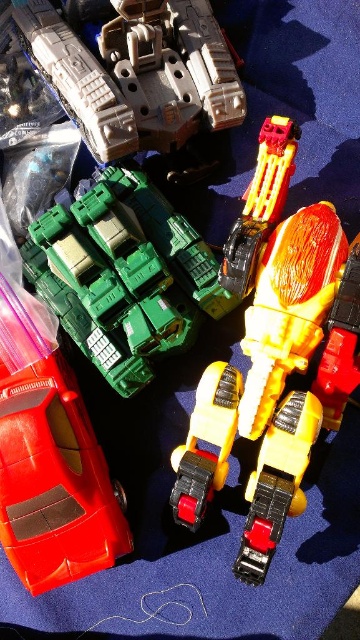
You are a child who wants to place a new toy between the shiny red car at lower left and the shiny plastic robot at center. The new toy is 30 centimeters long. Can you fit it between them?

The shiny red car at lower left is 57.64 centimeters away from the shiny plastic robot at center. Since the distance between them is greater than the length of the new toy, the toy can be placed between them.

Looking at this image, you are trying to place both the shiny red car at lower left and the shiny plastic robot at center on a shelf. The shelf has a width of 1.2 meters. Can both fit side by side without overlapping?

The shiny red car at lower left might be wider than the shiny plastic robot at center. Since the total width of both items is uncertain, it is possible they could fit within 1.2 meters if the combined width is less than or equal to 120 cm. However, without exact measurements, we cannot confirm for sure.

You are a child trying to reach for the shiny plastic car at center. There is a matte plastic robot at upper left in the way. Can you move the robot to get to the car?

The matte plastic robot at upper left is further to the viewer than the shiny plastic car at center, so you can move the matte plastic robot at upper left out of the way to access the shiny plastic car at center.